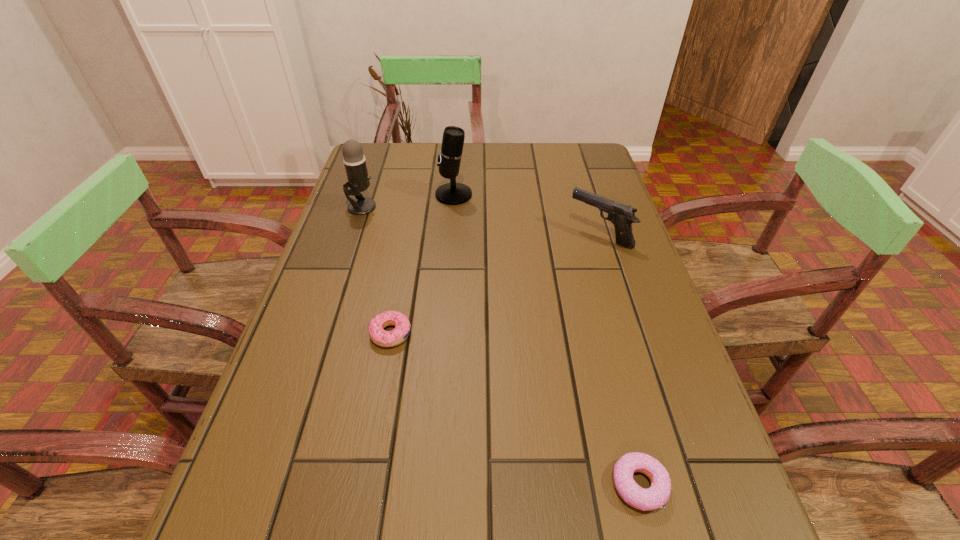
In the image, there is a desktop. What are the coordinates of `vacant space at the right edge` in the screenshot? It's located at (588, 185).

Where is `free space at the far left corner`? free space at the far left corner is located at coordinates (385, 178).

Where is `free spot between the nearer doughnut and the left microphone`? The height and width of the screenshot is (540, 960). free spot between the nearer doughnut and the left microphone is located at coordinates (501, 346).

This screenshot has height=540, width=960. I want to click on free space between the leftmost object and the second nearest object, so [376, 270].

Find the location of a particular element. unoccupied area between the left microphone and the third farthest object is located at coordinates (481, 221).

Identify the location of vacant area that lies between the third object from right to left and the left microphone. This screenshot has height=540, width=960. (408, 201).

At what (x,y) coordinates should I click in order to perform the action: click on vacant space that's between the nearer doughnut and the farther doughnut. Please return your answer as a coordinate pair (x, y). The width and height of the screenshot is (960, 540). Looking at the image, I should click on (516, 409).

Find the location of a particular element. This screenshot has width=960, height=540. free spot between the third nearest object and the left microphone is located at coordinates (481, 221).

At what (x,y) coordinates should I click in order to perform the action: click on empty space that is in between the gun and the right doughnut. Please return your answer as a coordinate pair (x, y). The image size is (960, 540). Looking at the image, I should click on (619, 360).

Image resolution: width=960 pixels, height=540 pixels. In order to click on blank region between the fourth object from right to left and the left microphone in this screenshot , I will do `click(376, 270)`.